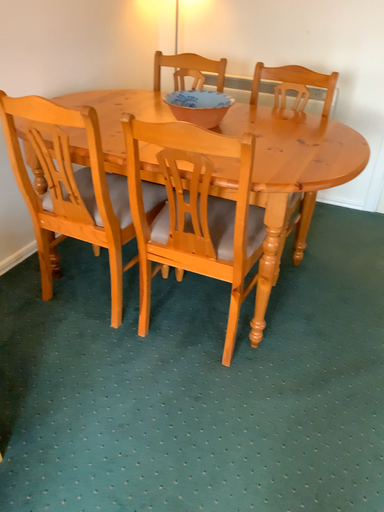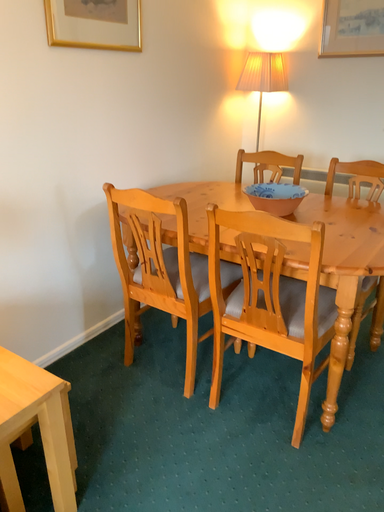
Question: Which way did the camera rotate in the video?

Choices:
 (A) rotated right
 (B) rotated left

Answer: (B)